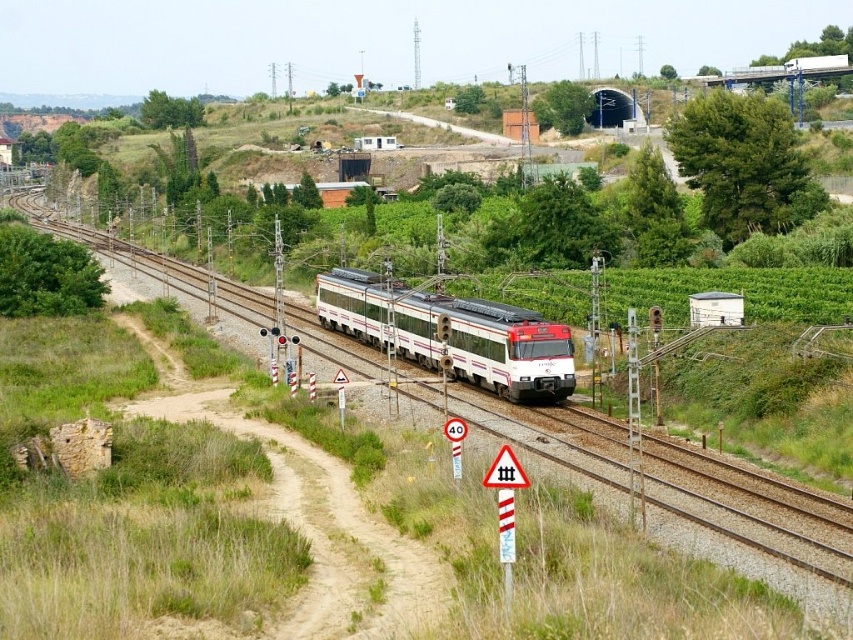
You are a photographer standing on the platform and see the white glossy train at center and the white glossy passenger train at center. Which one is closer to the left side of the platform?

The white glossy train at center is closer to the left side of the platform because it is positioned to the left of the white glossy passenger train at center.

You are a photographer planning to capture the white glossy train at center and the white glossy passenger train at center in a single shot. Since you want to highlight their height difference, which train should you position closer to the camera to emphasize its height advantage?

To emphasize the height difference between the white glossy train at center and the white glossy passenger train at center, you should position the white glossy train at center closer to the camera. This is because objects closer to the camera appear larger in the photo, which will make its greater height more noticeable compared to the white glossy passenger train at center.

You are a photographer standing at the origin point of the coordinate system in the railway scene. You want to capture a photo of the white glossy train at center. What are the coordinates where you should aim your camera to ensure the train is centered in the frame?

The coordinates to aim your camera are at point (749, 529) to center the white glossy train at center in the frame.